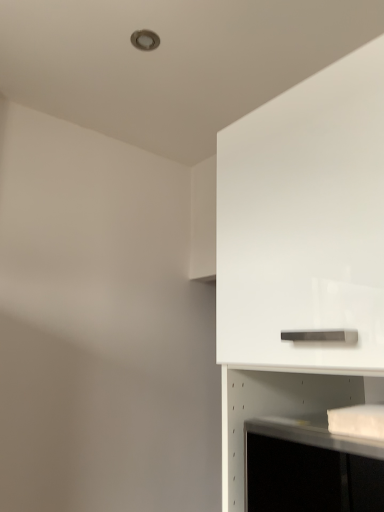
The image size is (384, 512). What do you see at coordinates (300, 246) in the screenshot?
I see `white glossy cabinet at upper right` at bounding box center [300, 246].

Locate an element on the screen. This screenshot has height=512, width=384. white glossy cabinet at upper right is located at coordinates (300, 246).

Measure the distance between white glossy shelf at lower right and camera.

white glossy shelf at lower right is 37.72 inches from camera.

You are a GUI agent. You are given a task and a screenshot of the screen. Output one action in this format:
    pyautogui.click(x=<x>, y=<y>)
    Task: Click on the white glossy shelf at lower right
    Image resolution: width=384 pixels, height=512 pixels.
    Given the screenshot: What is the action you would take?
    pyautogui.click(x=275, y=410)

What do you see at coordinates (275, 410) in the screenshot? I see `white glossy shelf at lower right` at bounding box center [275, 410].

Locate an element on the screen. This screenshot has height=512, width=384. white glossy cabinet at upper right is located at coordinates (300, 246).

Considering the relative positions of white glossy cabinet at upper right and white glossy shelf at lower right in the image provided, is white glossy cabinet at upper right to the right of white glossy shelf at lower right from the viewer's perspective?

Correct, you'll find white glossy cabinet at upper right to the right of white glossy shelf at lower right.

Considering their positions, is white glossy cabinet at upper right located in front of or behind white glossy shelf at lower right?

white glossy cabinet at upper right is in front of white glossy shelf at lower right.

Does point (332, 197) lie in front of point (239, 472)?

Yes, it is.

From the image's perspective, would you say white glossy cabinet at upper right is shown under white glossy shelf at lower right?

No, from the image's perspective, white glossy cabinet at upper right is not below white glossy shelf at lower right.

From a real-world perspective, does white glossy cabinet at upper right stand above white glossy shelf at lower right?

Yes, from a real-world perspective, white glossy cabinet at upper right is on top of white glossy shelf at lower right.

Looking at their sizes, would you say white glossy cabinet at upper right is wider or thinner than white glossy shelf at lower right?

Considering their sizes, white glossy cabinet at upper right looks broader than white glossy shelf at lower right.

Is white glossy cabinet at upper right taller than white glossy shelf at lower right?

Yes.

In the scene shown: Who is smaller, white glossy cabinet at upper right or white glossy shelf at lower right?

Smaller between the two is white glossy shelf at lower right.

Is white glossy shelf at lower right completely or partially inside white glossy cabinet at upper right?

Answer: Yes, white glossy shelf at lower right can be found within white glossy cabinet at upper right.

Is white glossy cabinet at upper right positioned far away from white glossy shelf at lower right?

They are positioned close to each other.

Is white glossy cabinet at upper right facing away from white glossy shelf at lower right?

No, white glossy cabinet at upper right's orientation is not away from white glossy shelf at lower right.

Where is `shelf that appears behind the white glossy cabinet at upper right`? shelf that appears behind the white glossy cabinet at upper right is located at coordinates (275, 410).

Is white glossy shelf at lower right to the left of white glossy cabinet at upper right from the viewer's perspective?

Yes, white glossy shelf at lower right is to the left of white glossy cabinet at upper right.

Which object is further away from the camera taking this photo, white glossy shelf at lower right or white glossy cabinet at upper right?

white glossy shelf at lower right.

Is point (229, 412) in front of point (274, 212)?

That is False.

From the image's perspective, is white glossy shelf at lower right under white glossy cabinet at upper right?

Yes, from the image's perspective, white glossy shelf at lower right is below white glossy cabinet at upper right.

From a real-world perspective, between white glossy shelf at lower right and white glossy cabinet at upper right, who is vertically lower?

In real-world perspective, white glossy shelf at lower right is lower.

Can you confirm if white glossy shelf at lower right is thinner than white glossy cabinet at upper right?

Correct, the width of white glossy shelf at lower right is less than that of white glossy cabinet at upper right.

Considering the sizes of objects white glossy shelf at lower right and white glossy cabinet at upper right in the image provided, who is taller, white glossy shelf at lower right or white glossy cabinet at upper right?

Standing taller between the two is white glossy cabinet at upper right.

Is white glossy shelf at lower right smaller than white glossy cabinet at upper right?

Yes.

Is white glossy shelf at lower right inside the boundaries of white glossy cabinet at upper right, or outside?

The correct answer is: inside.

Would you say white glossy shelf at lower right is a long distance from white glossy cabinet at upper right?

Actually, white glossy shelf at lower right and white glossy cabinet at upper right are a little close together.

Is white glossy shelf at lower right looking in the opposite direction of white glossy cabinet at upper right?

That's right, white glossy shelf at lower right is facing away from white glossy cabinet at upper right.

Locate an element on the screen. cabinetry in front of the white glossy shelf at lower right is located at coordinates [x=300, y=246].

In the image, there is a white glossy cabinet at upper right. Find the location of `shelf below it (from the image's perspective)`. shelf below it (from the image's perspective) is located at coordinates (275, 410).

Image resolution: width=384 pixels, height=512 pixels. I want to click on cabinetry in front of the white glossy shelf at lower right, so click(300, 246).